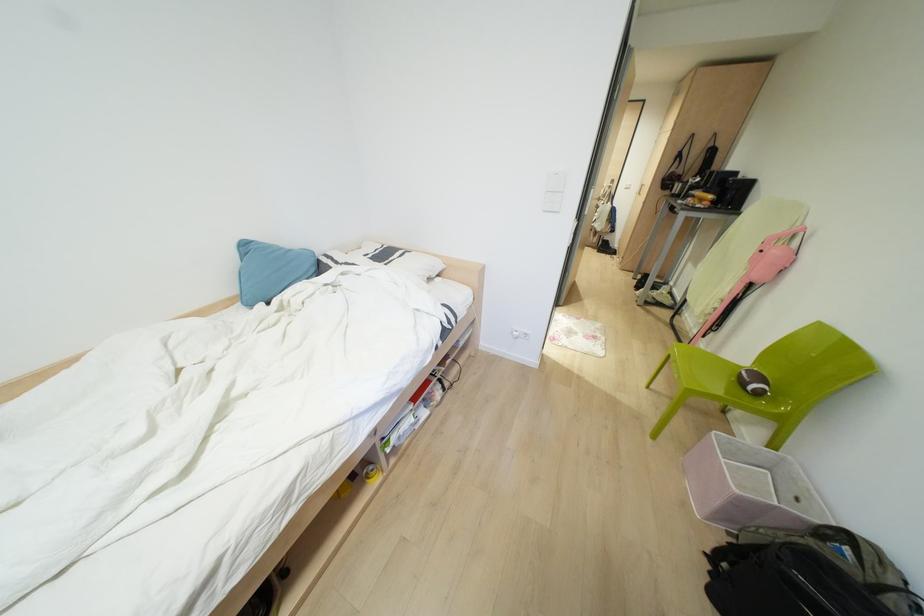
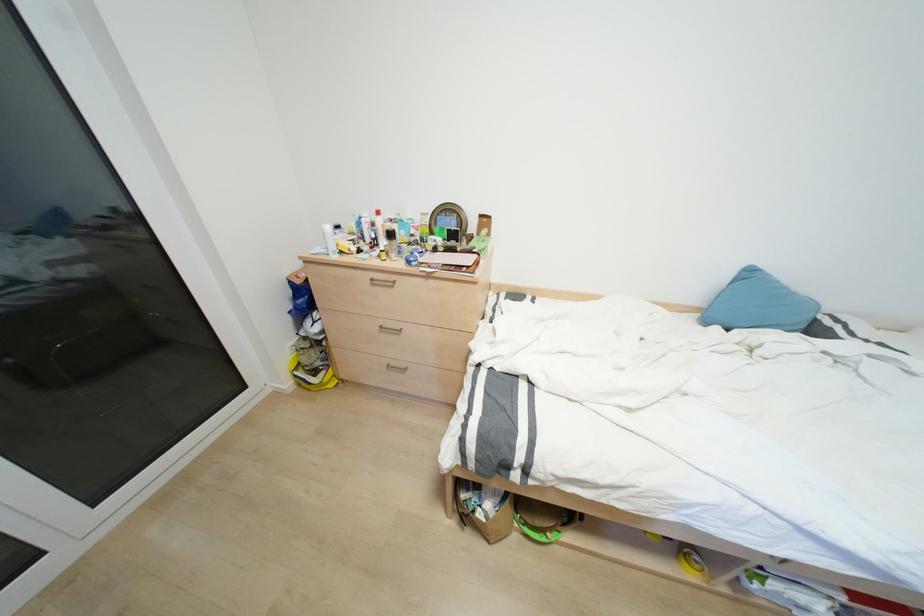
In the second image, find the point that corresponds to (371,467) in the first image.

(696, 557)